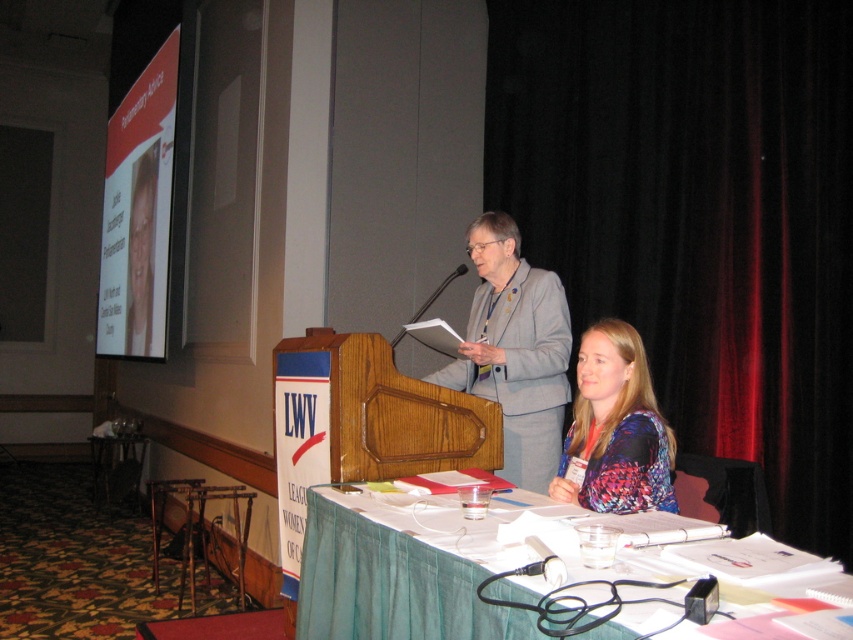
Can you confirm if white glossy projector screen at upper left is shorter than multicolored fabric shirt at lower right?

No, white glossy projector screen at upper left is not shorter than multicolored fabric shirt at lower right.

You are a GUI agent. You are given a task and a screenshot of the screen. Output one action in this format:
    pyautogui.click(x=<x>, y=<y>)
    Task: Click on the white glossy projector screen at upper left
    This screenshot has width=853, height=640.
    Given the screenshot: What is the action you would take?
    pyautogui.click(x=138, y=212)

You are a GUI agent. You are given a task and a screenshot of the screen. Output one action in this format:
    pyautogui.click(x=<x>, y=<y>)
    Task: Click on the white glossy projector screen at upper left
    
    Given the screenshot: What is the action you would take?
    pyautogui.click(x=138, y=212)

Image resolution: width=853 pixels, height=640 pixels. I want to click on white glossy projector screen at upper left, so click(x=138, y=212).

Looking at this image, who is positioned more to the left, multicolored fabric shirt at lower right or black plastic microphone at center?

Positioned to the left is black plastic microphone at center.

This screenshot has height=640, width=853. What do you see at coordinates (616, 428) in the screenshot?
I see `multicolored fabric shirt at lower right` at bounding box center [616, 428].

Image resolution: width=853 pixels, height=640 pixels. What are the coordinates of `multicolored fabric shirt at lower right` in the screenshot? It's located at (616, 428).

Can you confirm if white glossy projector screen at upper left is thinner than black plastic microphone at center?

No.

Is point (157, 310) closer to viewer compared to point (451, 273)?

No, it is not.

Measure the distance between point [154,323] and camera.

The distance of point [154,323] from camera is 5.46 meters.

Where is `white glossy projector screen at upper left`? Image resolution: width=853 pixels, height=640 pixels. white glossy projector screen at upper left is located at coordinates (138, 212).